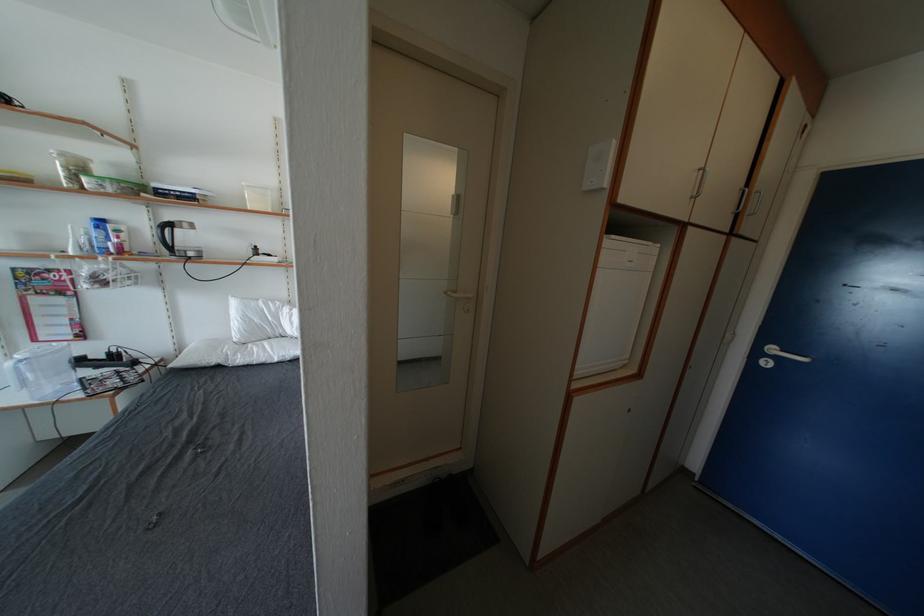
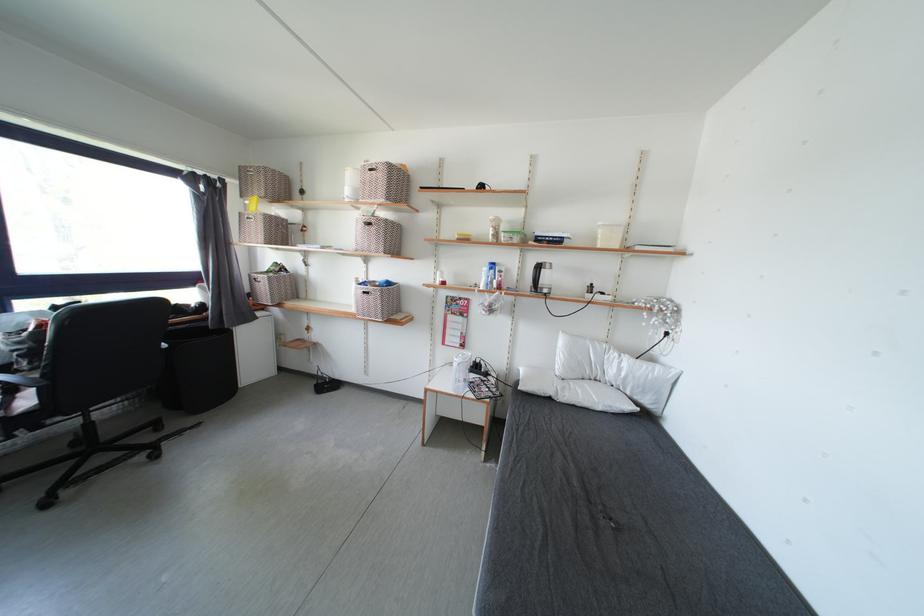
Locate, in the second image, the point that corresponds to point 78,342 in the first image.

(465, 351)